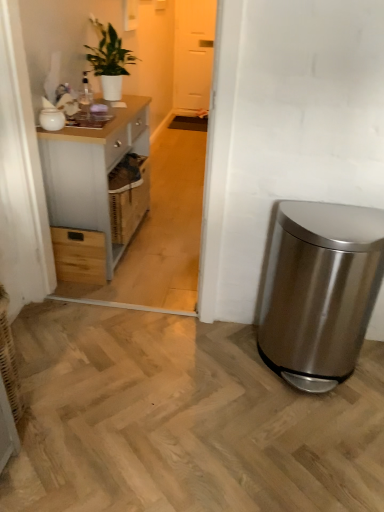
Question: From the image's perspective, would you say light gray wood cabinet at left is shown under white glossy jar at upper left?

Choices:
 (A) yes
 (B) no

Answer: (A)

Question: Is the depth of light gray wood cabinet at left greater than that of white glossy jar at upper left?

Choices:
 (A) no
 (B) yes

Answer: (A)

Question: Does light gray wood cabinet at left turn towards white glossy jar at upper left?

Choices:
 (A) no
 (B) yes

Answer: (A)

Question: Is light gray wood cabinet at left positioned far away from white glossy jar at upper left?

Choices:
 (A) no
 (B) yes

Answer: (A)

Question: Is light gray wood cabinet at left beside white glossy jar at upper left?

Choices:
 (A) yes
 (B) no

Answer: (B)

Question: Considering the positions of wooden drawer at left and green glossy plant at upper left in the image, is wooden drawer at left wider or thinner than green glossy plant at upper left?

Choices:
 (A) thin
 (B) wide

Answer: (A)

Question: From a real-world perspective, is wooden drawer at left above or below green glossy plant at upper left?

Choices:
 (A) below
 (B) above

Answer: (A)

Question: From the image's perspective, relative to green glossy plant at upper left, is wooden drawer at left above or below?

Choices:
 (A) below
 (B) above

Answer: (A)

Question: Is wooden drawer at left to the left or to the right of green glossy plant at upper left in the image?

Choices:
 (A) left
 (B) right

Answer: (A)

Question: Is point (84, 247) closer or farther from the camera than point (291, 250)?

Choices:
 (A) farther
 (B) closer

Answer: (A)

Question: In terms of size, does wooden drawer at left appear bigger or smaller than stainless steel trash can at lower right?

Choices:
 (A) small
 (B) big

Answer: (A)

Question: In terms of width, does wooden drawer at left look wider or thinner when compared to stainless steel trash can at lower right?

Choices:
 (A) wide
 (B) thin

Answer: (B)

Question: Considering the positions of wooden drawer at left and stainless steel trash can at lower right in the image, is wooden drawer at left taller or shorter than stainless steel trash can at lower right?

Choices:
 (A) tall
 (B) short

Answer: (B)

Question: Considering the positions of wooden drawer at left and white glossy jar at upper left in the image, is wooden drawer at left taller or shorter than white glossy jar at upper left?

Choices:
 (A) short
 (B) tall

Answer: (B)

Question: From a real-world perspective, is wooden drawer at left above or below white glossy jar at upper left?

Choices:
 (A) below
 (B) above

Answer: (A)